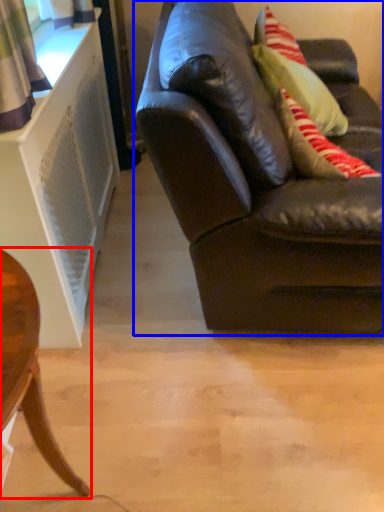
Question: Which point is further to the camera, chair (highlighted by a red box) or studio couch (highlighted by a blue box)?

Choices:
 (A) chair
 (B) studio couch

Answer: (B)